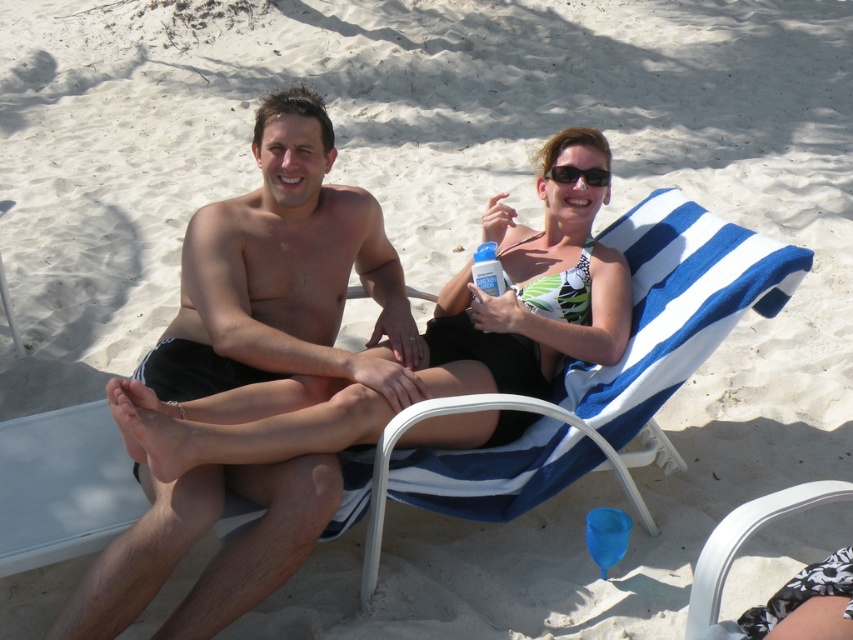
Question: Which object is closer to the camera taking this photo?

Choices:
 (A) black plastic sunglasses at upper center
 (B) white plastic beach chair at lower right
 (C) blue striped beach chair at center

Answer: (B)

Question: From the image, what is the correct spatial relationship of white plastic beach chair at lower right in relation to black plastic sunglasses at upper center?

Choices:
 (A) below
 (B) above

Answer: (A)

Question: Among these points, which one is farthest from the camera?

Choices:
 (A) (659, 369)
 (B) (556, 173)

Answer: (B)

Question: From the image, what is the correct spatial relationship of green and white bikini top at center in relation to black plastic sunglasses at upper center?

Choices:
 (A) left
 (B) right

Answer: (A)

Question: Which point is farther to the camera?

Choices:
 (A) black matte shorts at center
 (B) green and white bikini top at center
 (C) white plastic beach chair at lower right

Answer: (A)

Question: Can you confirm if black matte shorts at center is thinner than blue striped beach chair at center?

Choices:
 (A) no
 (B) yes

Answer: (B)